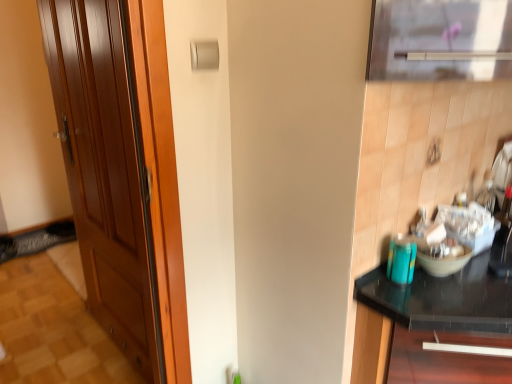
Question: From a real-world perspective, is shiny brown door at left positioned under black glass countertop at right based on gravity?

Choices:
 (A) yes
 (B) no

Answer: (B)

Question: Is shiny brown door at left positioned with its back to black glass countertop at right?

Choices:
 (A) yes
 (B) no

Answer: (B)

Question: Can you confirm if shiny brown door at left is wider than black glass countertop at right?

Choices:
 (A) yes
 (B) no

Answer: (B)

Question: Is shiny brown door at left aimed at black glass countertop at right?

Choices:
 (A) no
 (B) yes

Answer: (A)

Question: From the image's perspective, is shiny brown door at left located above black glass countertop at right?

Choices:
 (A) yes
 (B) no

Answer: (A)

Question: From the image's perspective, is shiny brown door at left located beneath black glass countertop at right?

Choices:
 (A) no
 (B) yes

Answer: (A)

Question: From a real-world perspective, is black glass countertop at right positioned over shiny brown door at left based on gravity?

Choices:
 (A) no
 (B) yes

Answer: (A)

Question: Is there a large distance between black glass countertop at right and shiny brown door at left?

Choices:
 (A) yes
 (B) no

Answer: (B)

Question: From the image's perspective, is black glass countertop at right located beneath shiny brown door at left?

Choices:
 (A) yes
 (B) no

Answer: (A)

Question: From the image's perspective, does black glass countertop at right appear higher than shiny brown door at left?

Choices:
 (A) yes
 (B) no

Answer: (B)

Question: Is black glass countertop at right wider than shiny brown door at left?

Choices:
 (A) no
 (B) yes

Answer: (B)

Question: Are black glass countertop at right and shiny brown door at left making contact?

Choices:
 (A) yes
 (B) no

Answer: (B)

Question: Looking at their shapes, would you say shiny brown door at left is wider or thinner than black glass countertop at right?

Choices:
 (A) wide
 (B) thin

Answer: (B)